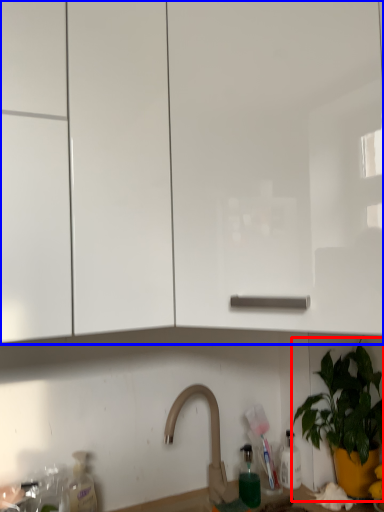
Question: Which object appears closest to the camera in this image, houseplant (highlighted by a red box) or cabinetry (highlighted by a blue box)?

Choices:
 (A) houseplant
 (B) cabinetry

Answer: (B)